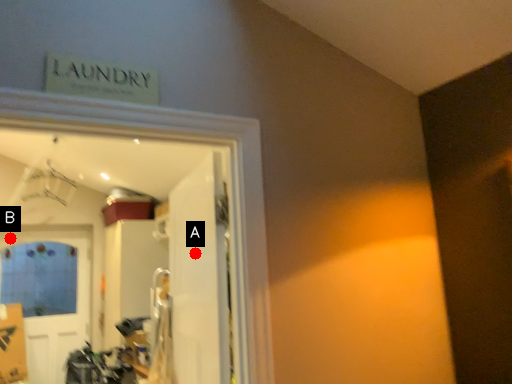
Question: Two points are circled on the image, labeled by A and B beside each circle. Among these points, which one is farthest from the camera?

Choices:
 (A) A is further
 (B) B is further

Answer: (B)